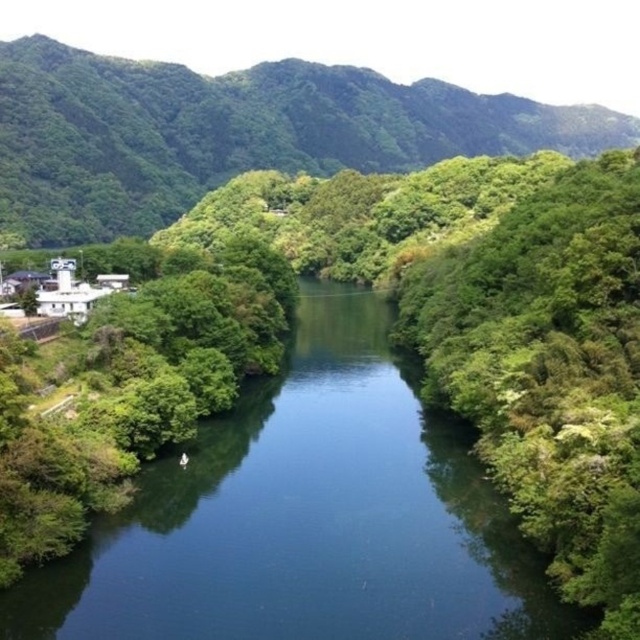
Question: Does blue smooth water at center appear under green leafy mountain at upper left?

Choices:
 (A) yes
 (B) no

Answer: (A)

Question: Does blue smooth water at center have a lesser width compared to green leafy mountain at upper left?

Choices:
 (A) no
 (B) yes

Answer: (B)

Question: Which point is farther to the camera?

Choices:
 (A) click(289, 554)
 (B) click(72, 54)

Answer: (B)

Question: Which of the following is the closest to the observer?

Choices:
 (A) blue smooth water at center
 (B) green leafy mountain at upper left

Answer: (A)

Question: Which object appears farthest from the camera in this image?

Choices:
 (A) blue smooth water at center
 (B) green leafy mountain at upper left

Answer: (B)

Question: Does blue smooth water at center have a smaller size compared to green leafy mountain at upper left?

Choices:
 (A) no
 (B) yes

Answer: (B)